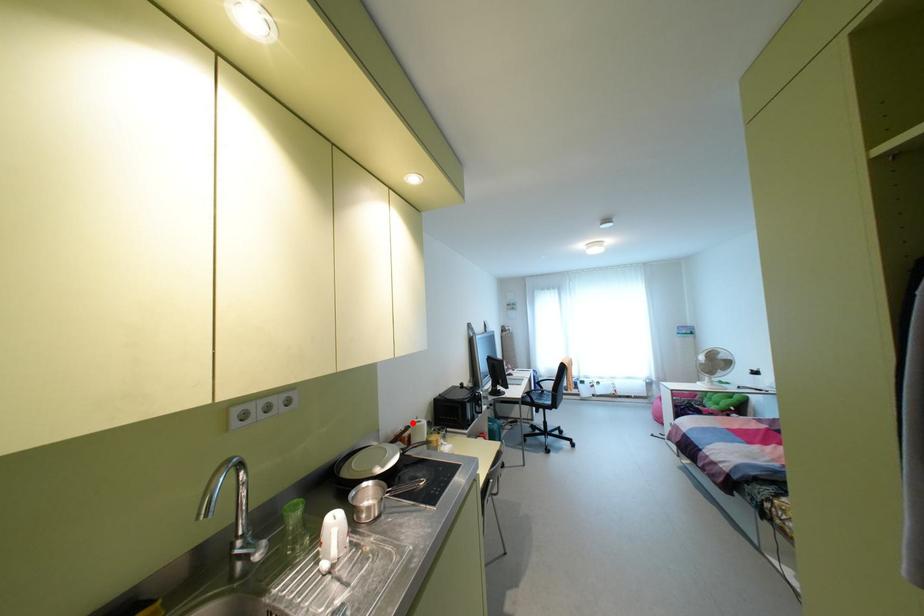
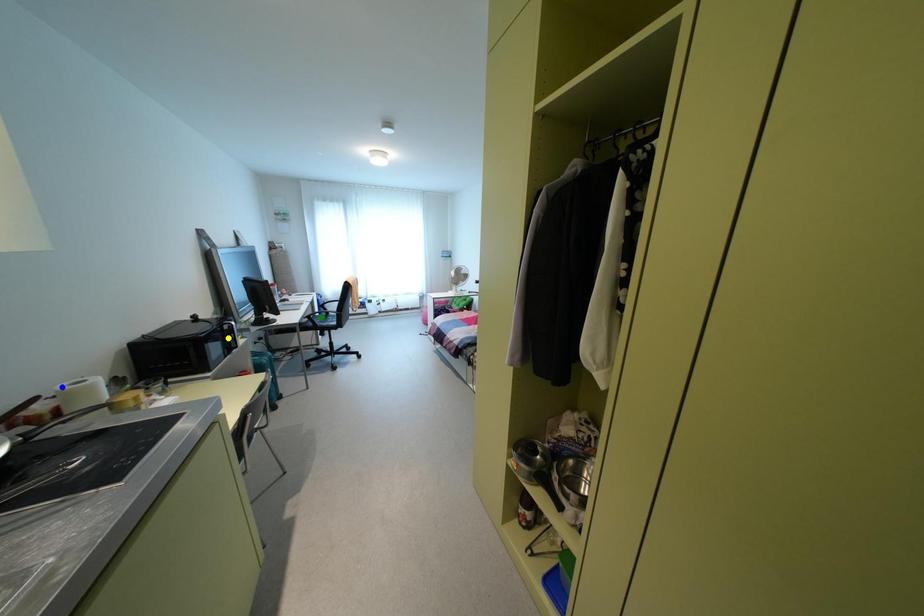
Question: I am providing you with two images of the same scene from different viewpoints. A red point is marked on the first image. You are given multiple points on the second image. Which point in image 2 represents the same 3d spot as the red point in image 1?

Choices:
 (A) blue point
 (B) green point
 (C) yellow point

Answer: (A)